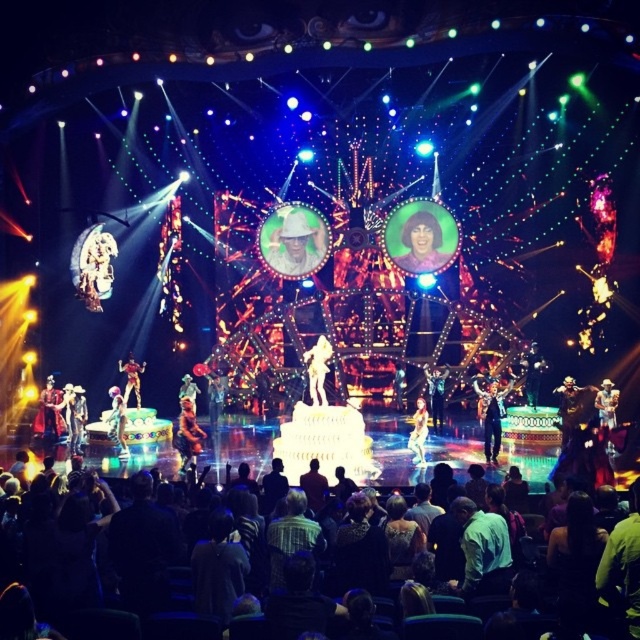
Which is below, shiny gold costume at center or shiny silver dress at center?

shiny gold costume at center is below.

Does shiny gold costume at center lie behind shiny silver dress at center?

No.

Where is `shiny gold costume at center`? The image size is (640, 640). shiny gold costume at center is located at coordinates (188, 435).

At what (x,y) coordinates should I click in order to perform the action: click on shiny gold costume at center. Please return your answer as a coordinate pair (x, y). This screenshot has width=640, height=640. Looking at the image, I should click on (188, 435).

Between point (481, 586) and point (408, 445), which one is positioned behind?

The point (408, 445) is more distant.

This screenshot has width=640, height=640. Describe the element at coordinates (620, 554) in the screenshot. I see `dark fabric seats at lower center` at that location.

The height and width of the screenshot is (640, 640). Find the location of `dark fabric seats at lower center`. dark fabric seats at lower center is located at coordinates (620, 554).

Between shiny silver dress at center and shiny black suit at center, which one is positioned lower?

shiny silver dress at center is lower down.

Does shiny silver dress at center have a smaller size compared to shiny black suit at center?

Yes.

Which is behind, point (412, 422) or point (432, 406)?

Positioned behind is point (412, 422).

Image resolution: width=640 pixels, height=640 pixels. I want to click on shiny silver dress at center, so click(x=419, y=433).